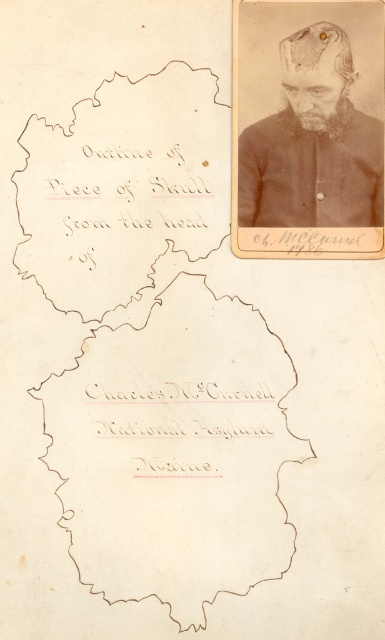
Is point (53, 392) positioned after point (246, 225)?

No, (53, 392) is closer to viewer.

Looking at this image, can you confirm if brown paper map at center is positioned above dark brown hair at upper right?

Incorrect, brown paper map at center is not positioned above dark brown hair at upper right.

Is point (185, 564) positioned in front of point (259, 205)?

Yes.

Find the location of a particular element. This screenshot has width=385, height=640. brown paper map at center is located at coordinates (175, 445).